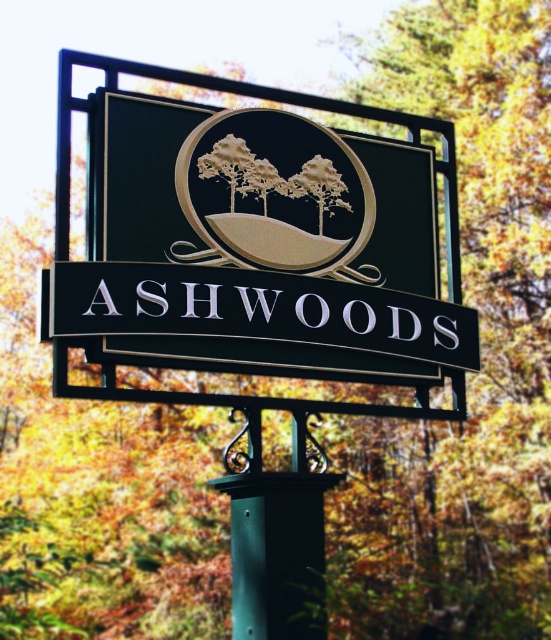
Question: Which object is closer to the camera taking this photo?

Choices:
 (A) metallic gold sign at center
 (B) matte gold emblem at center

Answer: (A)

Question: Can you confirm if metallic gold sign at center is wider than matte gold emblem at center?

Choices:
 (A) no
 (B) yes

Answer: (B)

Question: Can you confirm if metallic gold sign at center is positioned below matte gold emblem at center?

Choices:
 (A) no
 (B) yes

Answer: (B)

Question: Considering the relative positions of metallic gold sign at center and matte gold emblem at center in the image provided, where is metallic gold sign at center located with respect to matte gold emblem at center?

Choices:
 (A) below
 (B) above

Answer: (A)